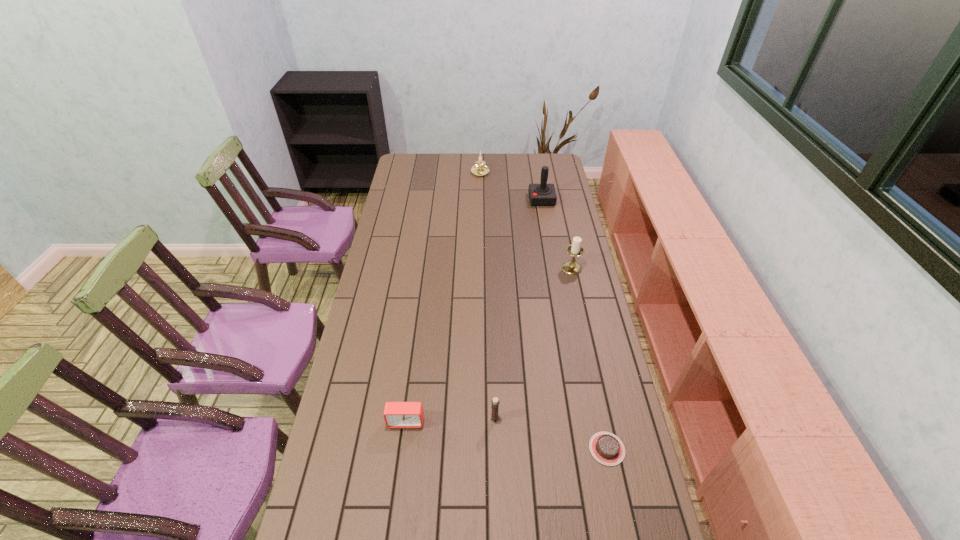
Locate an element on the screen. The width and height of the screenshot is (960, 540). vacant region located 0.390m on the base of the second farthest object is located at coordinates (452, 200).

The width and height of the screenshot is (960, 540). What are the coordinates of `vacant space located on the base of the second farthest object` in the screenshot? It's located at (501, 200).

Identify the location of blank area located 0.090m on the front of the tallest candle holder. The height and width of the screenshot is (540, 960). pyautogui.click(x=577, y=291).

At what (x,y) coordinates should I click in order to perform the action: click on vacant region located on the handle side of the farthest candle holder. Please return your answer as a coordinate pair (x, y). This screenshot has height=540, width=960. Looking at the image, I should click on (480, 202).

The height and width of the screenshot is (540, 960). What are the coordinates of `vacant area situated on the front of the nearest candle holder` in the screenshot? It's located at (496, 472).

You are a GUI agent. You are given a task and a screenshot of the screen. Output one action in this format:
    pyautogui.click(x=<x>, y=<y>)
    Task: Click on the vacant space located on the front-facing side of the fifth tallest object
    
    Given the screenshot: What is the action you would take?
    pyautogui.click(x=394, y=518)

You are a GUI agent. You are given a task and a screenshot of the screen. Output one action in this format:
    pyautogui.click(x=<x>, y=<y>)
    Task: Click on the vacant space located on the left of the chocolate cake
    This screenshot has height=540, width=960.
    Given the screenshot: What is the action you would take?
    pyautogui.click(x=471, y=449)

Find the location of a particular element. Image resolution: width=960 pixels, height=540 pixels. object located in the far edge section of the desktop is located at coordinates (480, 169).

This screenshot has width=960, height=540. Identify the location of joystick located in the right edge section of the desktop. (543, 194).

At what (x,y) coordinates should I click in order to perform the action: click on candle holder that is positioned at the right edge. Please return your answer as a coordinate pair (x, y). The height and width of the screenshot is (540, 960). Looking at the image, I should click on (575, 249).